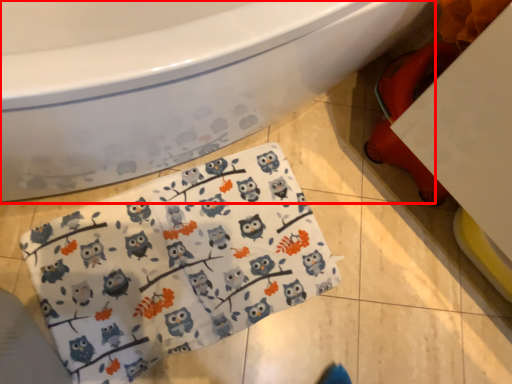
Question: From the image's perspective, where is bathtub (annotated by the red box) located in relation to baby clothe in the image?

Choices:
 (A) below
 (B) above

Answer: (B)